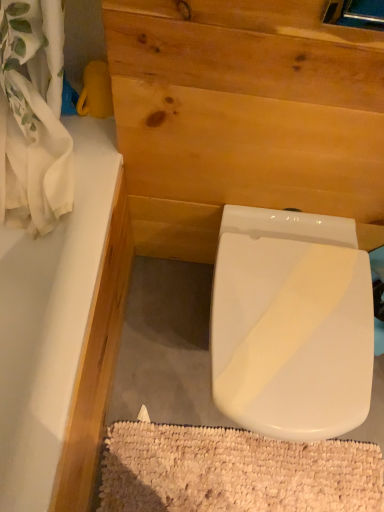
Find the location of a particular element. The width and height of the screenshot is (384, 512). free space above white textured bath mat at lower center (from a real-world perspective) is located at coordinates (241, 469).